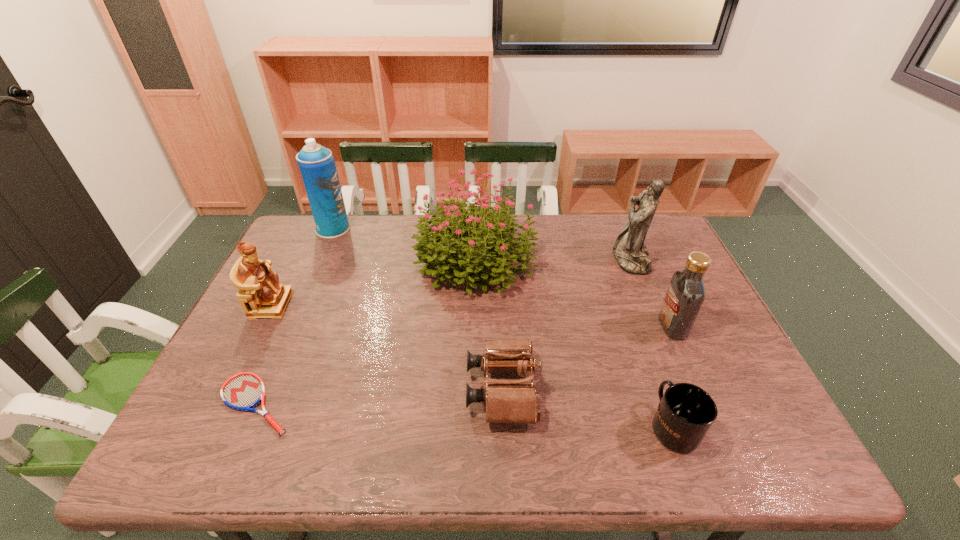
You are a GUI agent. You are given a task and a screenshot of the screen. Output one action in this format:
    pyautogui.click(x=<x>, y=<y>)
    Task: Click on the vacant space located 0.060m on the left of the aerosol can
    The image size is (960, 540).
    Given the screenshot: What is the action you would take?
    pyautogui.click(x=298, y=229)

You are a GUI agent. You are given a task and a screenshot of the screen. Output one action in this format:
    pyautogui.click(x=<x>, y=<y>)
    Task: Click on the free spot located on the front of the bouquet
    
    Given the screenshot: What is the action you would take?
    pyautogui.click(x=475, y=421)

Locate an element on the screen. The image size is (960, 540). blank space located 0.210m on the front-facing side of the farther figurine is located at coordinates (547, 259).

Locate an element on the screen. The image size is (960, 540). vacant area located 0.170m on the front-facing side of the farther figurine is located at coordinates (560, 259).

The height and width of the screenshot is (540, 960). I want to click on free region located on the front-facing side of the farther figurine, so click(550, 259).

Where is `blank space located on the front-facing side of the vodka`? Image resolution: width=960 pixels, height=540 pixels. blank space located on the front-facing side of the vodka is located at coordinates (558, 326).

What are the coordinates of `blank space located on the front-facing side of the vodka` in the screenshot? It's located at (573, 326).

At what (x,y) coordinates should I click in order to perform the action: click on vacant space located on the front-facing side of the vodka. Please return your answer as a coordinate pair (x, y). Looking at the image, I should click on (637, 326).

You are a GUI agent. You are given a task and a screenshot of the screen. Output one action in this format:
    pyautogui.click(x=<x>, y=<y>)
    Task: Click on the free spot located on the front-facing side of the shorter figurine
    The width and height of the screenshot is (960, 540).
    Given the screenshot: What is the action you would take?
    pyautogui.click(x=331, y=305)

The height and width of the screenshot is (540, 960). What are the coordinates of `free space located through the eyepieces of the binoculars` in the screenshot? It's located at (390, 389).